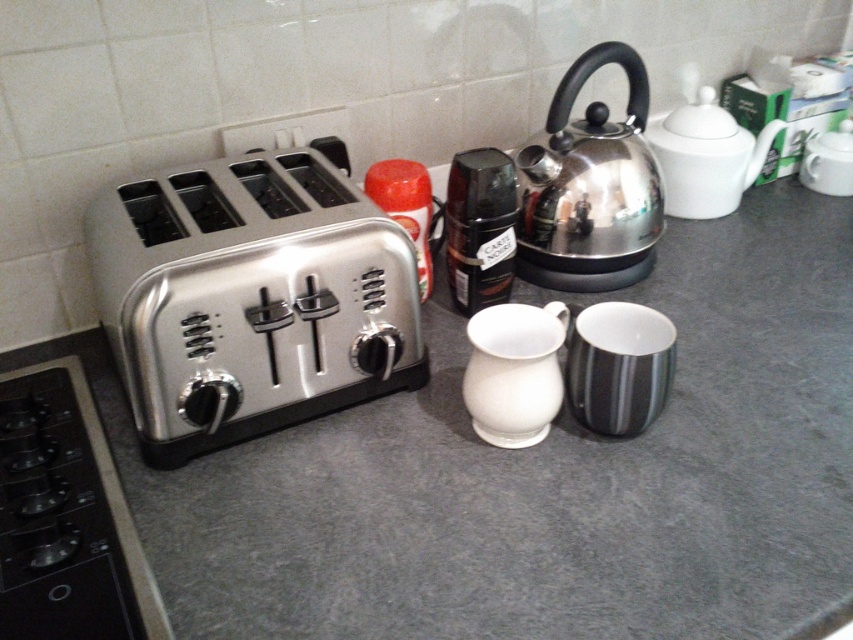
Is satin silver toaster at left above brushed metal toaster at left?

Correct, satin silver toaster at left is located above brushed metal toaster at left.

Looking at this image, does satin silver toaster at left have a lesser height compared to brushed metal toaster at left?

Incorrect, satin silver toaster at left's height does not fall short of brushed metal toaster at left's.

Which is in front, point (148, 179) or point (148, 624)?

Positioned in front is point (148, 624).

Image resolution: width=853 pixels, height=640 pixels. Identify the location of satin silver toaster at left. (250, 298).

In the scene shown: Can you confirm if white glossy teapot at upper right is thinner than shiny black coffee grinder at center?

No.

Between point (699, 216) and point (490, 147), which one is positioned behind?

The point (699, 216) is more distant.

Identify the location of white glossy teapot at upper right. Image resolution: width=853 pixels, height=640 pixels. (706, 156).

Which is more to the right, brushed metal toaster at left or shiny metallic kettle at upper right?

shiny metallic kettle at upper right is more to the right.

Between brushed metal toaster at left and shiny metallic kettle at upper right, which one is positioned higher?

Positioned higher is shiny metallic kettle at upper right.

Image resolution: width=853 pixels, height=640 pixels. Find the location of `brushed metal toaster at left`. brushed metal toaster at left is located at coordinates (65, 516).